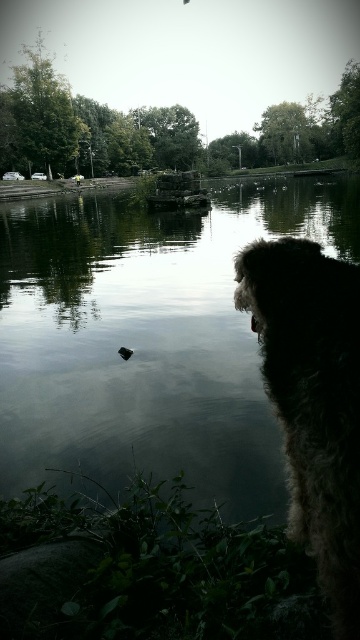
Based on the photo, who is shorter, smooth reflective water at center or fuzzy brown dog at right?

With less height is fuzzy brown dog at right.

Which is in front, point (123, 426) or point (330, 516)?

Point (330, 516)

Measure the distance between smooth reflective water at center and camera.

They are 6.64 feet apart.

The height and width of the screenshot is (640, 360). Find the location of `smooth reflective water at center`. smooth reflective water at center is located at coordinates (149, 339).